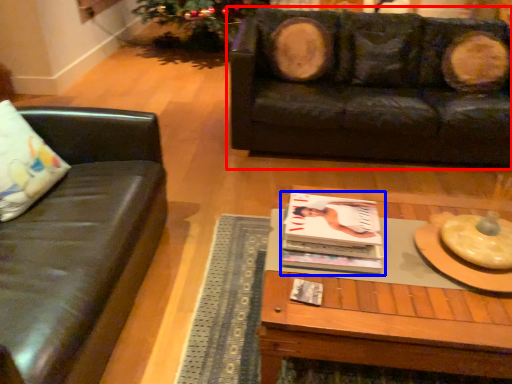
Question: Which of the following is the farthest to the observer, studio couch (highlighted by a red box) or magazine (highlighted by a blue box)?

Choices:
 (A) studio couch
 (B) magazine

Answer: (A)